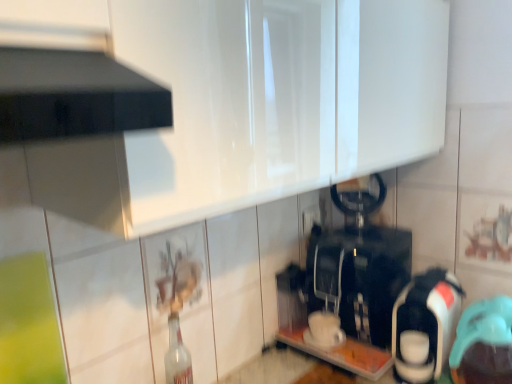
Question: Which direction should I rotate to look at black plastic coffee machine at center, arranged as the 3th appliance when viewed from the right, — up or down?

Choices:
 (A) up
 (B) down

Answer: (B)

Question: Considering the relative sizes of teal rubber cap at lower right, which is the 3th appliance in left-to-right order, and white glossy coffee maker at right, which ranks as the second appliance in left-to-right order, in the image provided, is teal rubber cap at lower right, which is the 3th appliance in left-to-right order, smaller than white glossy coffee maker at right, which ranks as the second appliance in left-to-right order,?

Choices:
 (A) yes
 (B) no

Answer: (A)

Question: Would you say teal rubber cap at lower right, positioned as the 1th appliance in right-to-left order, contains white glossy coffee maker at right, which ranks as the second appliance in left-to-right order?

Choices:
 (A) no
 (B) yes

Answer: (A)

Question: Does teal rubber cap at lower right, which is the 3th appliance in left-to-right order, lie in front of white glossy coffee maker at right, which is the 2th appliance from right to left?

Choices:
 (A) no
 (B) yes

Answer: (B)

Question: Does teal rubber cap at lower right, positioned as the 1th appliance in right-to-left order, touch white glossy coffee maker at right, which is the 2th appliance from right to left?

Choices:
 (A) yes
 (B) no

Answer: (B)

Question: Is teal rubber cap at lower right, which is the 3th appliance in left-to-right order, shorter than white glossy coffee maker at right, which ranks as the second appliance in left-to-right order?

Choices:
 (A) yes
 (B) no

Answer: (A)

Question: Is teal rubber cap at lower right, which is the 3th appliance in left-to-right order, not within white glossy coffee maker at right, which ranks as the second appliance in left-to-right order?

Choices:
 (A) no
 (B) yes

Answer: (B)

Question: Does black plastic coffee machine at center, the first appliance viewed from the left, have a greater height compared to clear glass bottle at center?

Choices:
 (A) yes
 (B) no

Answer: (A)

Question: Considering the relative sizes of black plastic coffee machine at center, arranged as the 3th appliance when viewed from the right, and clear glass bottle at center in the image provided, is black plastic coffee machine at center, arranged as the 3th appliance when viewed from the right, wider than clear glass bottle at center?

Choices:
 (A) no
 (B) yes

Answer: (B)

Question: Is clear glass bottle at center inside black plastic coffee machine at center, arranged as the 3th appliance when viewed from the right?

Choices:
 (A) no
 (B) yes

Answer: (A)

Question: Is black plastic coffee machine at center, the first appliance viewed from the left, smaller than clear glass bottle at center?

Choices:
 (A) yes
 (B) no

Answer: (B)

Question: From a real-world perspective, is black plastic coffee machine at center, the first appliance viewed from the left, under clear glass bottle at center?

Choices:
 (A) no
 (B) yes

Answer: (A)

Question: Is black plastic coffee machine at center, the first appliance viewed from the left, outside of clear glass bottle at center?

Choices:
 (A) no
 (B) yes

Answer: (B)

Question: Considering the relative sizes of teal rubber cap at lower right, positioned as the 1th appliance in right-to-left order, and black plastic coffee machine at center, arranged as the 3th appliance when viewed from the right, in the image provided, is teal rubber cap at lower right, positioned as the 1th appliance in right-to-left order, smaller than black plastic coffee machine at center, arranged as the 3th appliance when viewed from the right,?

Choices:
 (A) yes
 (B) no

Answer: (A)